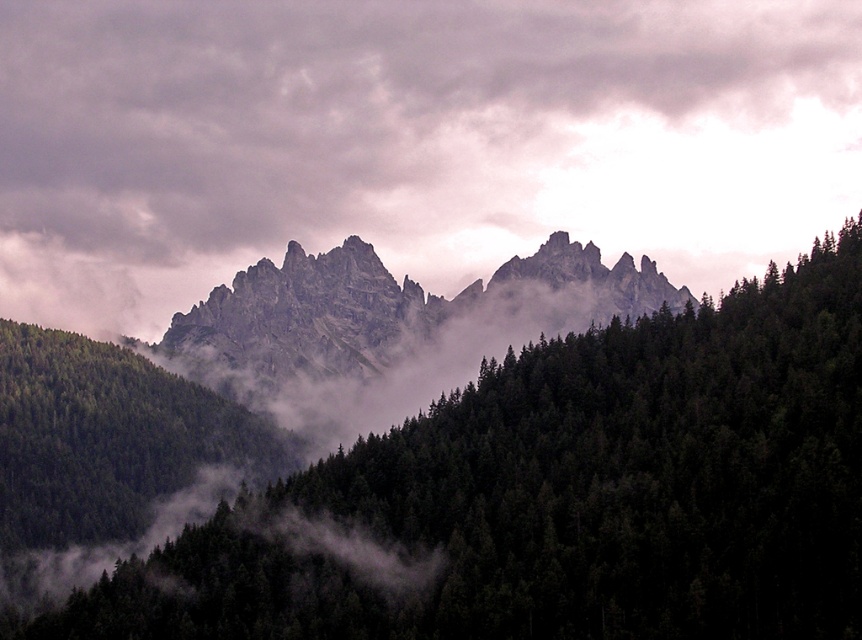
You are an airplane pilot flying over the mountainous landscape described. You need to determine the safest path between the gray cloudy sky at upper center and the rugged stone mountain at center. Which one should you avoid flying through?

You should avoid flying through the rugged stone mountain at center because it is a solid structure, whereas the gray cloudy sky at upper center is open space where the airplane can safely pass through.

You are a hiker planning to cross the valley between the dark green textured trees at center and the rugged stone mountain at center. Based on the scene, which object is narrower and might allow for a safer path?

The dark green textured trees at center is narrower than the rugged stone mountain at center, so the path through the trees might be safer.

Consider the image. You are a drone operator trying to capture a photo of the gray cloudy sky at upper center. The drone has a camera with a 50mm lens. To ensure the sky is in the center of the photo, where should you position the drone relative to the landscape?

The gray cloudy sky at upper center is located at coordinates point (409,140), so the drone should position itself directly above that point to center the sky in the photo.